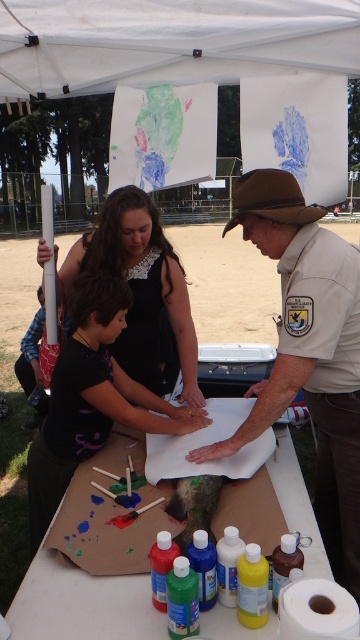
You are organizing a craft activity and need to place both the matte cardboard table at center and the matte black dress at center on a shelf. Which object should you place first to ensure they both fit on the shelf?

The matte cardboard table at center is smaller than the matte black dress at center. Therefore, you should place the matte black dress at center first to ensure there is enough space for the smaller matte cardboard table at center afterward.

Based on the photo, you are standing at the position of the child in the scene. There are two points marked in the image, one at coordinates point (x=129, y=61) and the other at point (x=308, y=582). Which point is closer to you?

Point (x=129, y=61) is behind point (x=308, y=582), so the closer point to you is point (x=308, y=582).